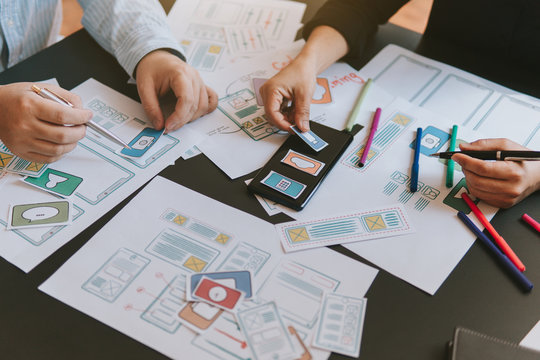
The height and width of the screenshot is (360, 540). Identify the location of sheets of paper. (177, 199), (135, 187), (240, 162), (211, 19), (377, 186), (441, 84).